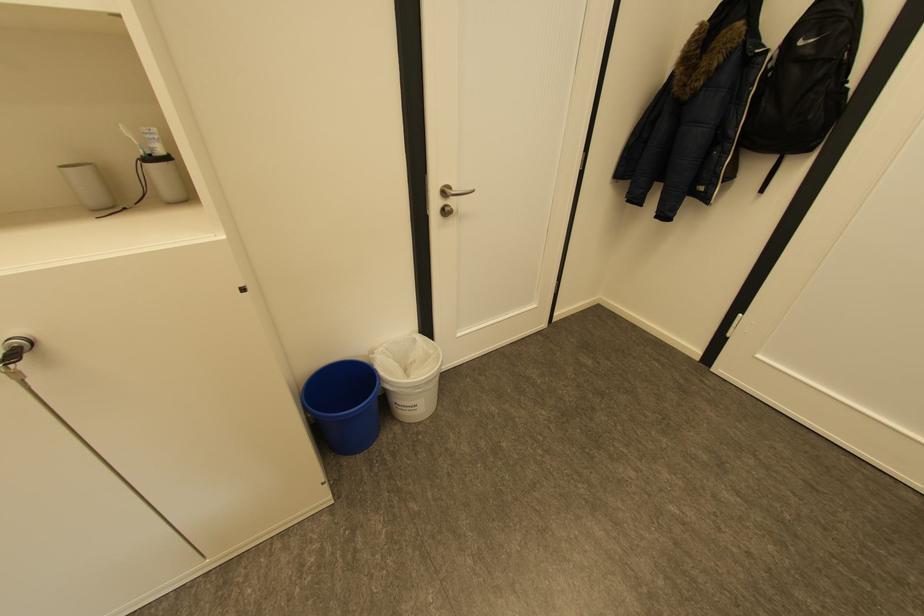
Image resolution: width=924 pixels, height=616 pixels. I want to click on blue trash can, so click(x=344, y=405).